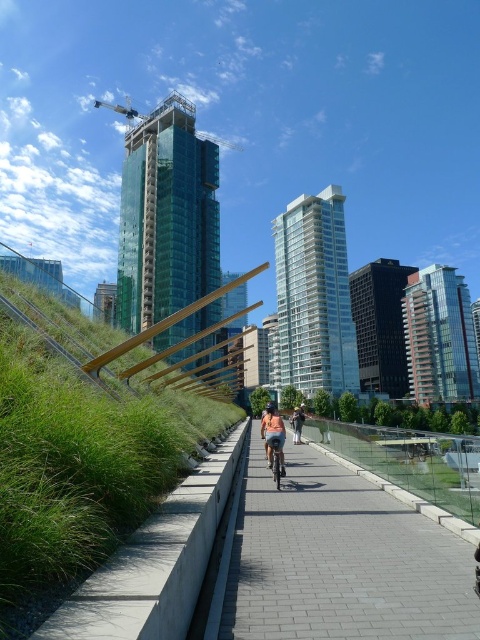
You are a pedestrian standing on the gray brick pavement at center. You want to cross the path to reach the glass railing on the other side. Is the metallic silver bicycle at center blocking your way?

The gray brick pavement at center is in front of the metallic silver bicycle at center, so the bicycle is behind you. Therefore, the metallic silver bicycle at center is not blocking your path to the glass railing.

You are standing on the pathway and see the green grass at center and the denim shorts at center. Which object is positioned to the left of the other?

The green grass at center is to the left of the denim shorts at center.

From the picture: You are standing on the paved pathway in the urban scene. You see the green grass at center and the denim shorts at center. How far apart are these two objects?

The green grass at center and denim shorts at center are 18.08 feet apart.